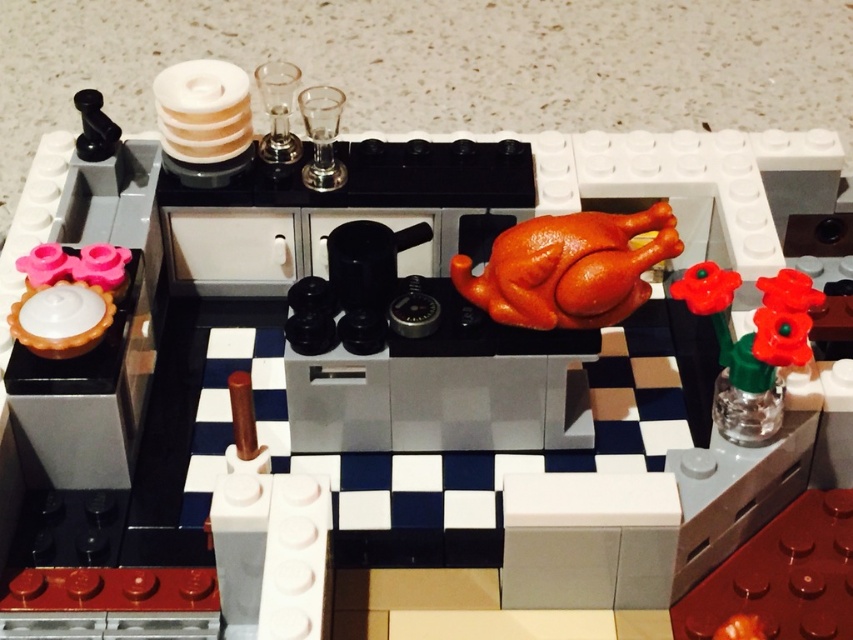
In the LEGO kitchen scene, there is a shiny orange turkey at center and a translucent green glass vase at right. Which object is shorter?

The shiny orange turkey at center is shorter than the translucent green glass vase at right.

You are setting up a Thanksgiving dinner table and have a shiny orange turkey at center and a translucent green glass vase at right. Which item requires more counter space due to its size?

The shiny orange turkey at center requires more counter space because its width is larger than the translucent green glass vase at right.

You are a small toy mouse that is 1 inch wide. You are currently on the countertop and want to move from the shiny orange turkey at center to the translucent green glass vase at right. Can you fit through the space between them without touching either?

The distance between the shiny orange turkey at center and the translucent green glass vase at right is 3.28 inches. Since you are only 1 inch wide, you have enough space to move through the gap without touching either object.